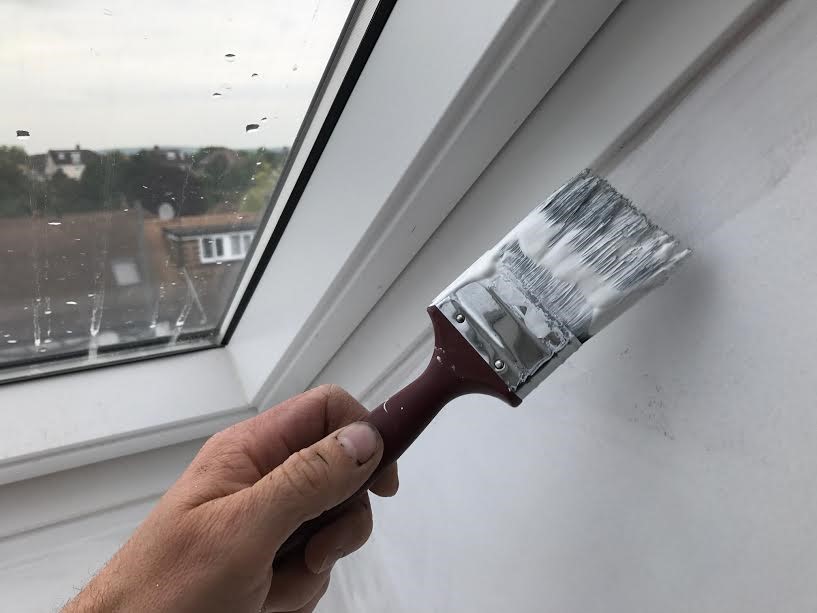
At what (x,y) coordinates should I click in order to perform the action: click on skylight window. Please return your answer as a coordinate pair (x, y). This screenshot has height=613, width=817. Looking at the image, I should click on (176, 184).